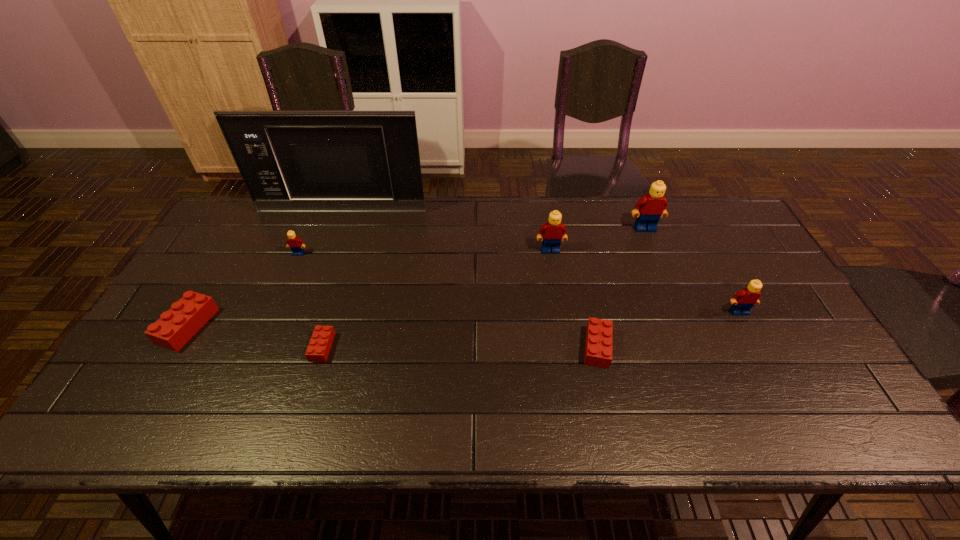
Where is `microwave oven`? This screenshot has width=960, height=540. microwave oven is located at coordinates (299, 161).

The height and width of the screenshot is (540, 960). I want to click on dark microwave oven, so click(x=299, y=161).

Where is `the tallest Lego`? the tallest Lego is located at coordinates (653, 205).

At what (x,y) coordinates should I click in order to perform the action: click on the second object from right to left. Please return your answer as a coordinate pair (x, y). Image resolution: width=960 pixels, height=540 pixels. Looking at the image, I should click on coord(653,205).

Find the location of a particular element. Image resolution: width=960 pixels, height=540 pixels. the third yellow Lego from right to left is located at coordinates (553, 231).

Locate an element on the screen. The image size is (960, 540). the second tallest Lego is located at coordinates (553, 231).

I want to click on the fifth shortest Lego, so click(x=744, y=300).

This screenshot has width=960, height=540. What are the coordinates of `the nearest yellow Lego` in the screenshot? It's located at click(x=744, y=300).

I want to click on the fifth tallest object, so click(x=294, y=243).

Locate an element on the screen. the leftmost yellow Lego is located at coordinates (294, 243).